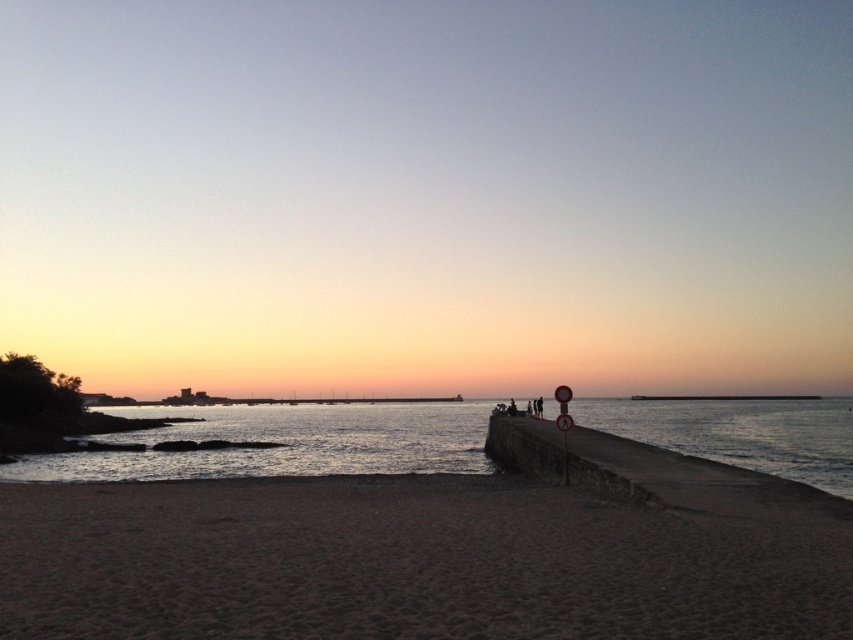
Question: Which object appears closest to the camera in this image?

Choices:
 (A) silvery reflective water at lower left
 (B) dark brown sand at lower center

Answer: (B)

Question: Where is dark brown sand at lower center located in relation to silvery reflective water at lower left in the image?

Choices:
 (A) below
 (B) above

Answer: (B)

Question: Which of the following is the farthest from the observer?

Choices:
 (A) dark brown sand at lower center
 (B) silvery reflective water at lower left

Answer: (B)

Question: Which point is farther from the camera taking this photo?

Choices:
 (A) (236, 451)
 (B) (654, 600)

Answer: (A)

Question: Is dark brown sand at lower center thinner than silvery reflective water at lower left?

Choices:
 (A) yes
 (B) no

Answer: (A)

Question: Does dark brown sand at lower center come behind silvery reflective water at lower left?

Choices:
 (A) yes
 (B) no

Answer: (B)